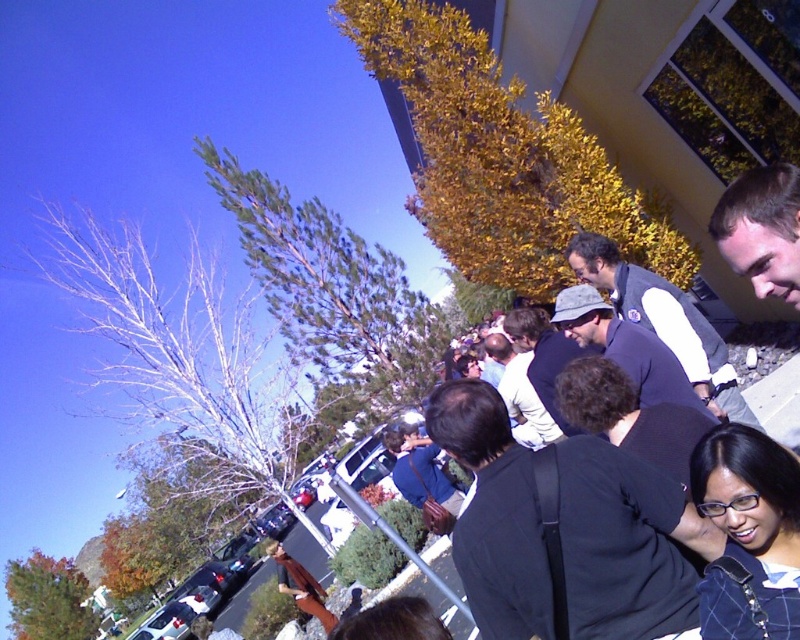
Which is in front, point (672, 502) or point (513, 310)?

Positioned in front is point (672, 502).

Can you confirm if black matte jacket at center is positioned below dark blue shirt at center?

Indeed, black matte jacket at center is positioned under dark blue shirt at center.

What do you see at coordinates (626, 544) in the screenshot? I see `black matte jacket at center` at bounding box center [626, 544].

Identify the location of black matte jacket at center. (626, 544).

Can you confirm if matte black hat at center is positioned below dark blue shirt at center?

No, matte black hat at center is not below dark blue shirt at center.

Which is behind, point (660, 358) or point (529, 314)?

Positioned behind is point (529, 314).

The width and height of the screenshot is (800, 640). I want to click on matte black hat at center, so click(x=625, y=348).

The image size is (800, 640). Identify the location of matte black hat at center. (625, 348).

Is black matte jacket at center taller than matte black hat at center?

Yes.

Does black matte jacket at center have a lesser height compared to matte black hat at center?

No, black matte jacket at center is not shorter than matte black hat at center.

Image resolution: width=800 pixels, height=640 pixels. Describe the element at coordinates (626, 544) in the screenshot. I see `black matte jacket at center` at that location.

You are a GUI agent. You are given a task and a screenshot of the screen. Output one action in this format:
    pyautogui.click(x=<x>, y=<y>)
    Task: Click on the black matte jacket at center
    The width and height of the screenshot is (800, 640).
    Given the screenshot: What is the action you would take?
    pyautogui.click(x=626, y=544)